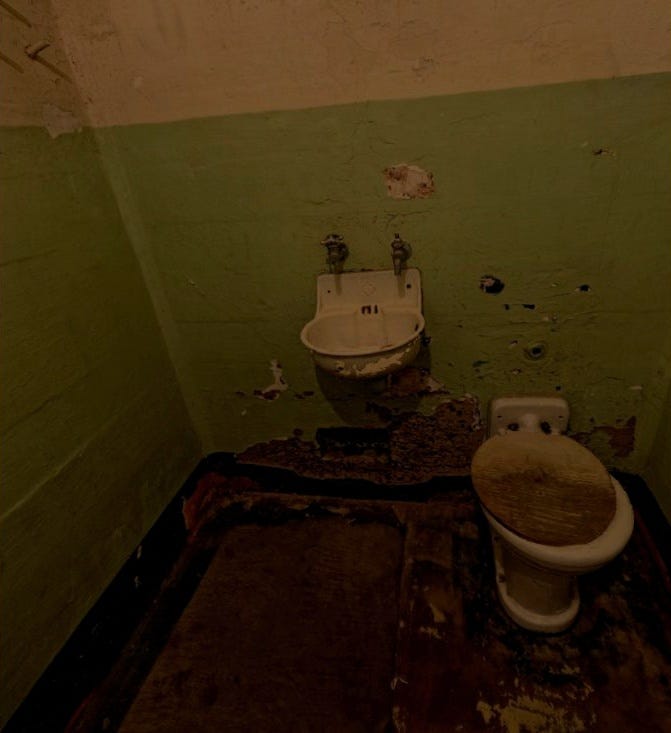
Identify the location of sink. (380, 317).